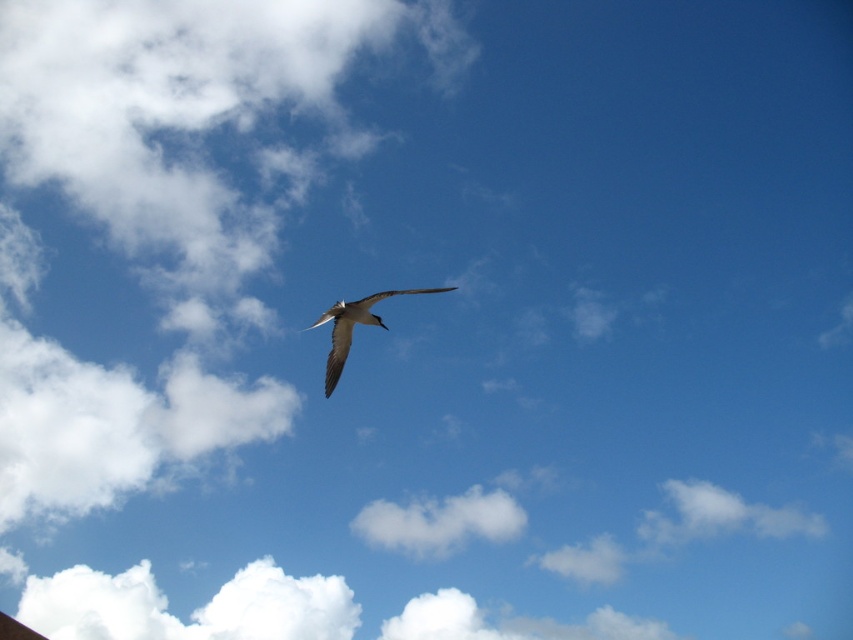
You are a photographer trying to capture the bird in flight against the sky. You notice a point marked at coordinates point (439,522). What is located at that point?

The point (439,522) marks a white fluffy cloud at center.

You are standing on the ground and see the white fluffy cloud at center and the white feathered bird at center. Which one is closer to you?

The white feathered bird at center is closer to you because it is 7.30 meters away from the white fluffy cloud at center, and since both are at the same central position, the bird is nearer than the cloud.